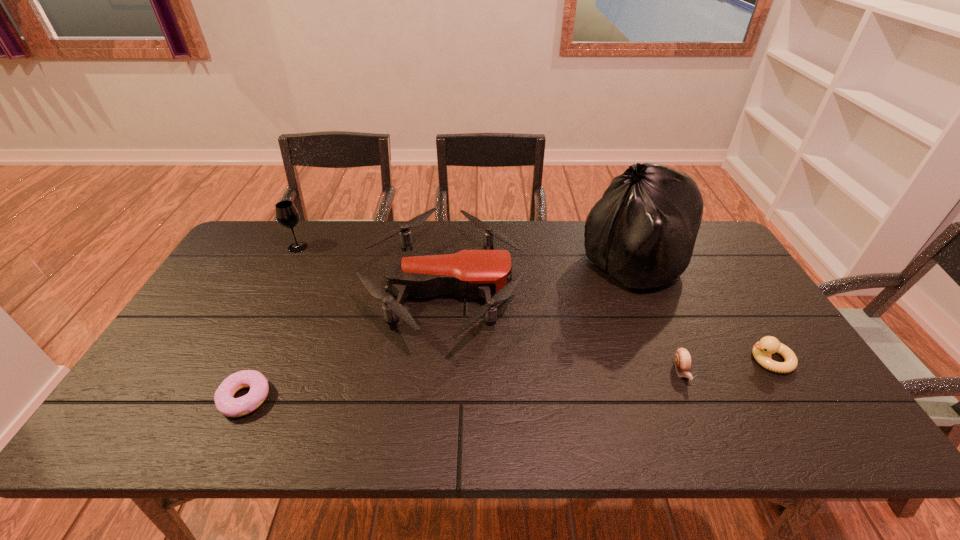
This screenshot has height=540, width=960. I want to click on free space located 0.310m on the front-facing side of the third tallest object, so click(623, 288).

Where is `vacant space located at the beak of the third shortest object`? The image size is (960, 540). vacant space located at the beak of the third shortest object is located at coordinates (640, 360).

Image resolution: width=960 pixels, height=540 pixels. Find the location of `vacant space located at the beak of the third shortest object`. vacant space located at the beak of the third shortest object is located at coordinates (704, 360).

Locate an element on the screen. Image resolution: width=960 pixels, height=540 pixels. free space located 0.140m at the beak of the third shortest object is located at coordinates (692, 360).

Identify the location of free spot located on the front-facing side of the second shortest object. The height and width of the screenshot is (540, 960). (709, 437).

This screenshot has width=960, height=540. Find the location of `vacant space located on the back of the doughnut`. vacant space located on the back of the doughnut is located at coordinates (279, 326).

The width and height of the screenshot is (960, 540). I want to click on plastic bag that is at the far edge, so click(642, 232).

Locate an element on the screen. This screenshot has width=960, height=540. wineglass that is at the far edge is located at coordinates (287, 215).

Where is `drone located in the far edge section of the desktop`? The image size is (960, 540). drone located in the far edge section of the desktop is located at coordinates (487, 273).

I want to click on object that is at the near edge, so click(x=225, y=403).